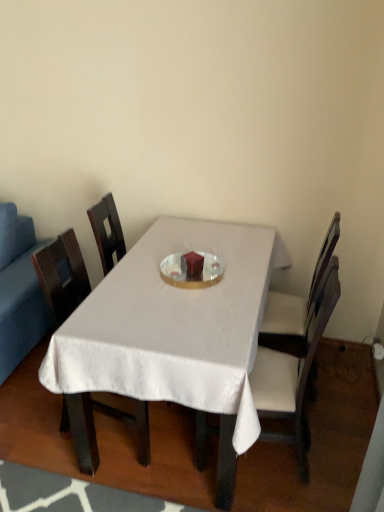
At what (x,y) coordinates should I click in order to perform the action: click on vacant area located to the right-hand side of white fabric chair at center, arranged as the 3th chair when viewed from the left. Please return your answer as a coordinate pair (x, y). Image resolution: width=384 pixels, height=512 pixels. Looking at the image, I should click on pyautogui.click(x=341, y=380).